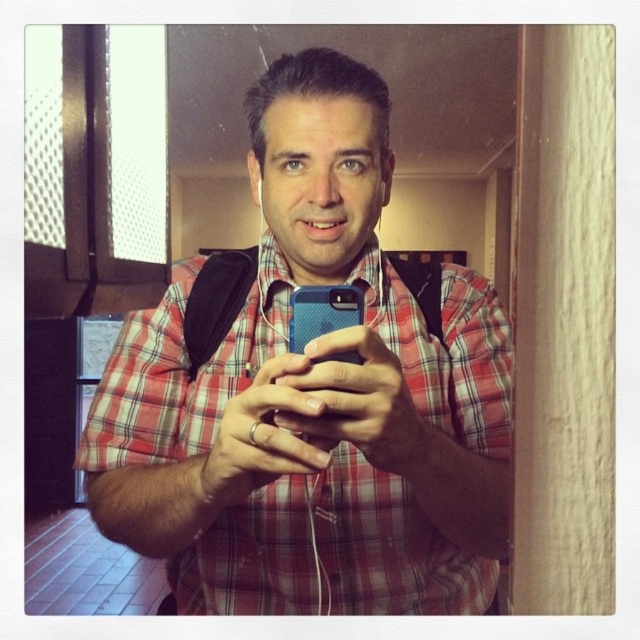
Question: Can you confirm if blue matte phone at center is positioned above blue textured phone at center?

Choices:
 (A) yes
 (B) no

Answer: (B)

Question: Which point is farther to the camera?

Choices:
 (A) blue matte phone at center
 (B) blue textured phone at center

Answer: (B)

Question: Among these points, which one is nearest to the camera?

Choices:
 (A) (308, 305)
 (B) (364, 385)

Answer: (B)

Question: Does blue matte phone at center have a larger size compared to blue textured phone at center?

Choices:
 (A) no
 (B) yes

Answer: (B)

Question: Which point appears farthest from the camera in this image?

Choices:
 (A) (344, 298)
 (B) (202, 266)

Answer: (B)

Question: Does blue matte phone at center appear on the right side of blue textured phone at center?

Choices:
 (A) no
 (B) yes

Answer: (A)